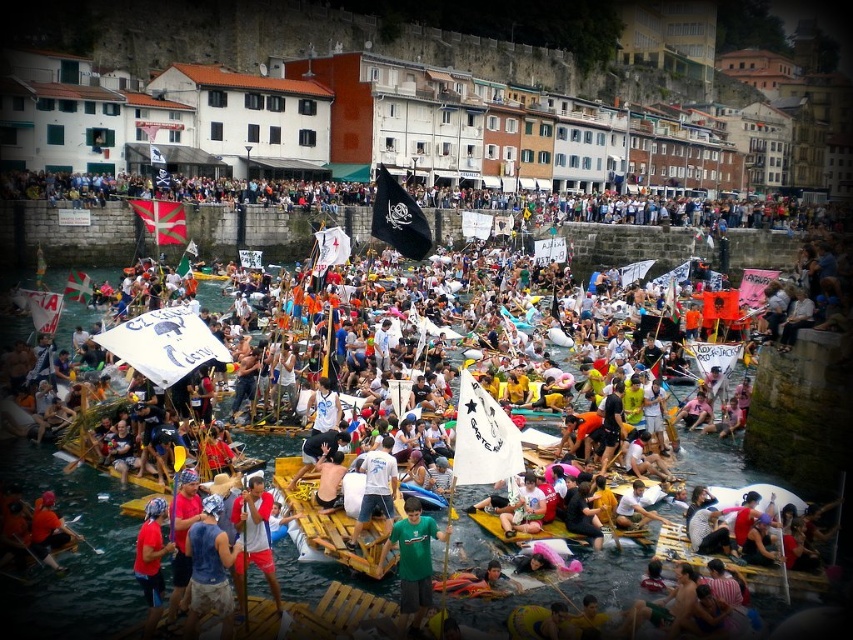
Can you confirm if green fabric shirt at center is bigger than white cotton t-shirt at center?

Correct, green fabric shirt at center is larger in size than white cotton t-shirt at center.

Which is more to the right, green fabric shirt at center or white cotton t-shirt at center?

green fabric shirt at center is more to the right.

Between point (424, 534) and point (395, 484), which one is positioned in front?

Point (424, 534) is more forward.

You are a GUI agent. You are given a task and a screenshot of the screen. Output one action in this format:
    pyautogui.click(x=<x>, y=<y>)
    Task: Click on the green fabric shirt at center
    
    Given the screenshot: What is the action you would take?
    pyautogui.click(x=413, y=563)

Who is shorter, white paper banners at upper center or red fabric headscarf at lower left?

With less height is red fabric headscarf at lower left.

Is point (641, 198) in front of point (158, 616)?

That is False.

This screenshot has height=640, width=853. In order to click on white paper banners at upper center in this screenshot , I will do `click(183, 189)`.

Is wooden raft at center positioned at the back of green fabric shirt at center?

No, it is not.

Is point (71, 605) more distant than point (404, 582)?

No.

The width and height of the screenshot is (853, 640). Describe the element at coordinates (73, 557) in the screenshot. I see `wooden raft at center` at that location.

The height and width of the screenshot is (640, 853). Identify the location of wooden raft at center. (73, 557).